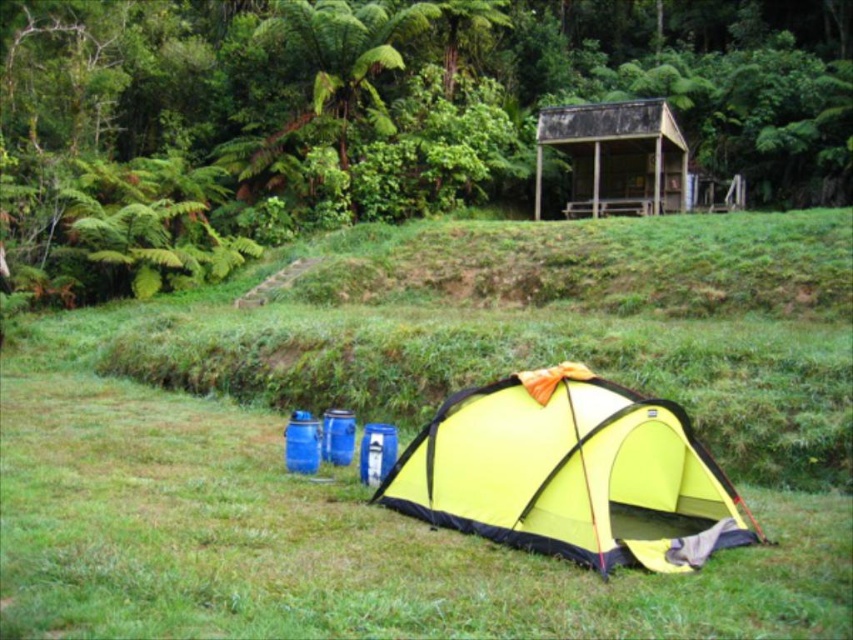
You are a camper who wants to set up a picnic blanket. You have a picnic blanket that is 2 meters wide. The green grassy at lower center and the weathered wood hut at upper center are in your view. Can you place the blanket between them without it overlapping either object?

The green grassy at lower center is to the left of the weathered wood hut at upper center, so there is space between them. The picnic blanket that is 2 meters wide can be placed between them without overlapping either object as long as the distance between the two objects is at least 2 meters.